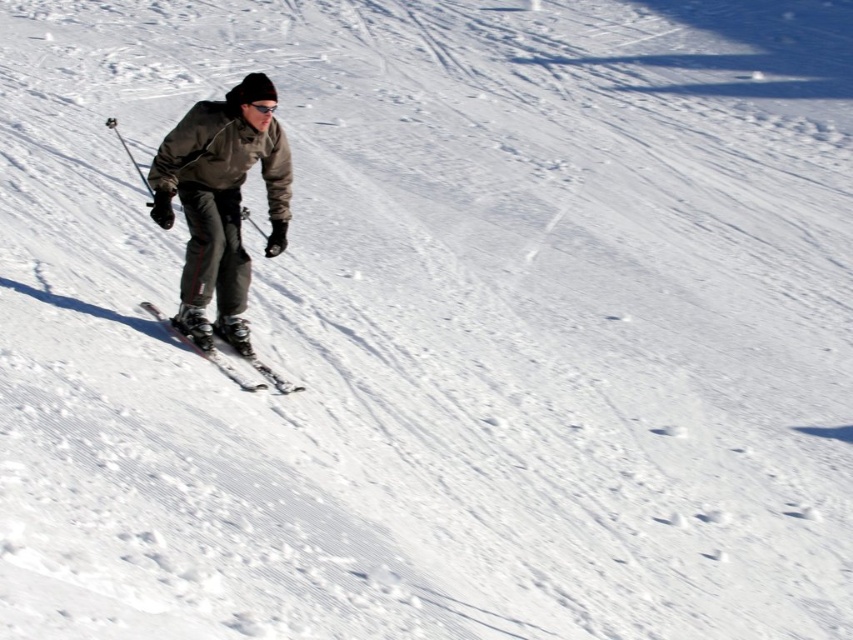
Does gray softshell jacket at center appear on the left side of metallic skis at center?

No, gray softshell jacket at center is not to the left of metallic skis at center.

Does gray softshell jacket at center come in front of metallic skis at center?

Yes.

Between point (285, 212) and point (287, 380), which one is positioned behind?

Positioned behind is point (285, 212).

Locate an element on the screen. The height and width of the screenshot is (640, 853). gray softshell jacket at center is located at coordinates (221, 202).